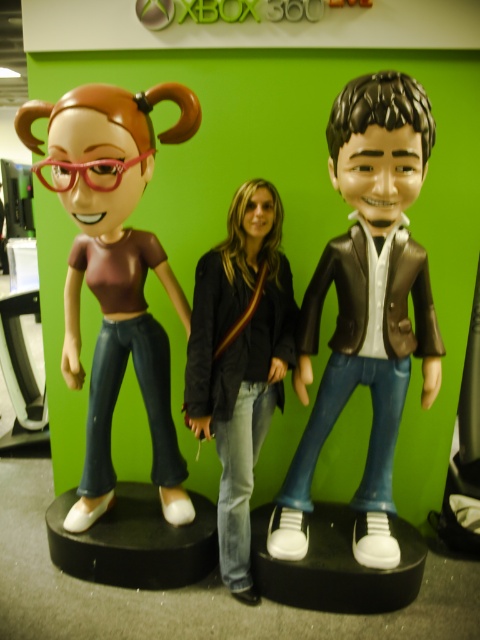
Question: Does matte black bobblehead at right have a larger size compared to denim jeans at center?

Choices:
 (A) no
 (B) yes

Answer: (B)

Question: Which point is farther from the camera taking this photo?

Choices:
 (A) (225, 404)
 (B) (336, 168)
 (C) (187, 307)

Answer: (C)

Question: In this image, where is matte black bobblehead at right located relative to matte brown bobblehead at left?

Choices:
 (A) right
 (B) left

Answer: (A)

Question: Which of these objects is positioned closest to the matte black bobblehead at right?

Choices:
 (A) matte brown bobblehead at left
 (B) denim jeans at center

Answer: (B)

Question: Which is farther from the denim jeans at center?

Choices:
 (A) matte black bobblehead at right
 (B) matte brown bobblehead at left

Answer: (B)

Question: Does matte black bobblehead at right lie in front of matte brown bobblehead at left?

Choices:
 (A) no
 (B) yes

Answer: (B)